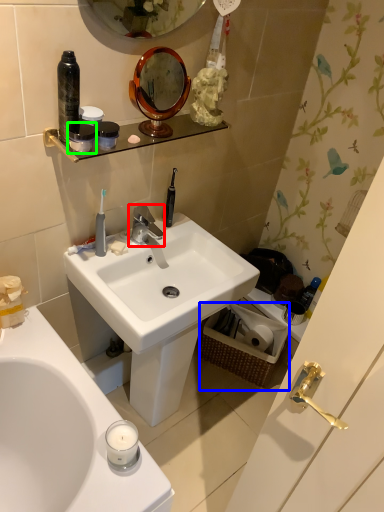
Question: Based on their relative distances, which object is nearer to tap (highlighted by a red box)? Choose from picnic basket (highlighted by a blue box) and mouthwash (highlighted by a green box).

Choices:
 (A) picnic basket
 (B) mouthwash

Answer: (B)